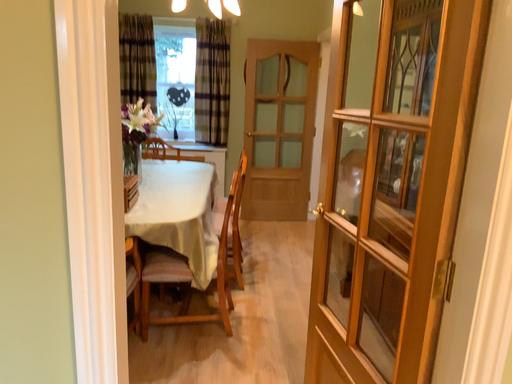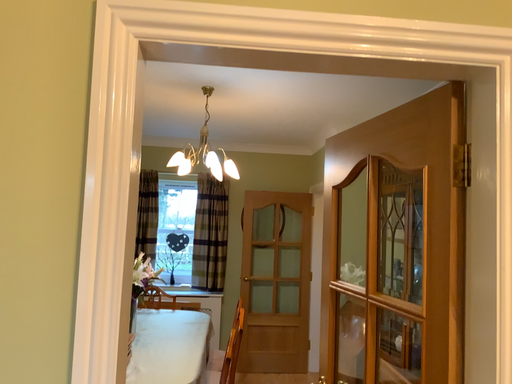
Question: Which way did the camera rotate in the video?

Choices:
 (A) rotated downward
 (B) rotated upward

Answer: (B)